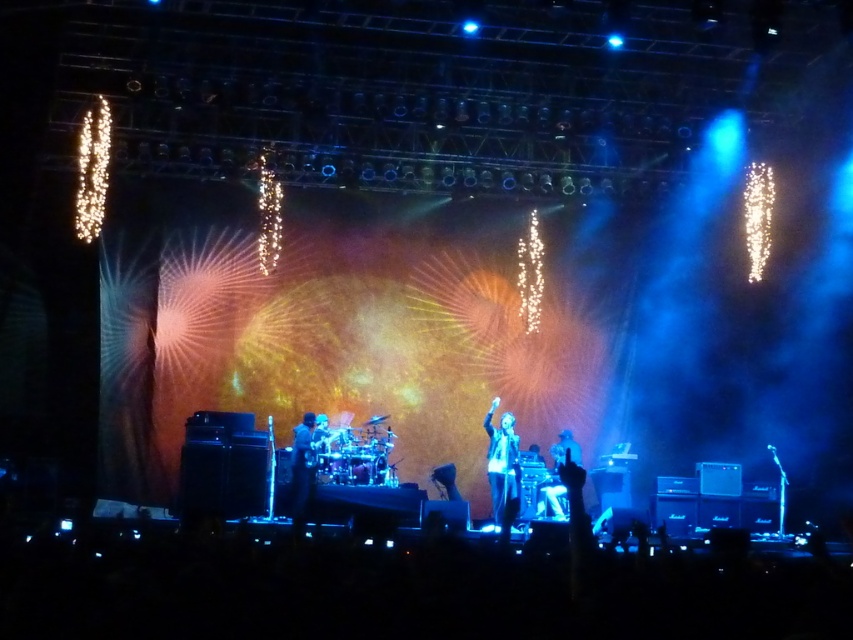
The image size is (853, 640). What are the coordinates of `shiny black jacket at center` in the screenshot? It's located at (502, 461).

Where is `shiny black jacket at center`? Image resolution: width=853 pixels, height=640 pixels. shiny black jacket at center is located at coordinates (502, 461).

Which of these two, shiny black jacket at center or shiny silver microphone at center, stands shorter?

With less height is shiny silver microphone at center.

Is shiny black jacket at center positioned at the back of shiny silver microphone at center?

No, it is in front of shiny silver microphone at center.

Is point (515, 509) more distant than point (549, 500)?

No, it is not.

Find the location of a particular element. The width and height of the screenshot is (853, 640). shiny black jacket at center is located at coordinates (502, 461).

Between point (294, 490) and point (553, 448), which one is positioned behind?

Point (553, 448)

Can you confirm if dark fabric jacket at center is positioned above shiny silver microphone at center?

Indeed, dark fabric jacket at center is positioned over shiny silver microphone at center.

The height and width of the screenshot is (640, 853). Describe the element at coordinates (302, 468) in the screenshot. I see `dark fabric jacket at center` at that location.

In order to click on dark fabric jacket at center in this screenshot , I will do `click(302, 468)`.